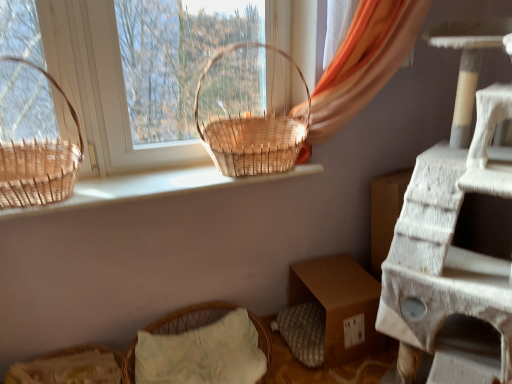
Question: Would you say woven natural basket at center, placed as the second picnic basket when sorted from left to right, is outside natural wood basket at upper center?

Choices:
 (A) no
 (B) yes

Answer: (B)

Question: Considering the relative positions of woven natural basket at center, which appears as the 1th picnic basket when viewed from the right, and natural wood basket at upper center in the image provided, is woven natural basket at center, which appears as the 1th picnic basket when viewed from the right, behind natural wood basket at upper center?

Choices:
 (A) yes
 (B) no

Answer: (A)

Question: Is woven natural basket at center, placed as the second picnic basket when sorted from left to right, at the left side of natural wood basket at upper center?

Choices:
 (A) yes
 (B) no

Answer: (B)

Question: From a real-world perspective, is woven natural basket at center, which appears as the 1th picnic basket when viewed from the right, under natural wood basket at upper center?

Choices:
 (A) yes
 (B) no

Answer: (B)

Question: Does woven natural basket at center, which appears as the 1th picnic basket when viewed from the right, have a greater width compared to natural wood basket at upper center?

Choices:
 (A) no
 (B) yes

Answer: (B)

Question: Considering the relative positions of orange fabric curtain at upper right and natural wood basket at upper center in the image provided, is orange fabric curtain at upper right to the left or to the right of natural wood basket at upper center?

Choices:
 (A) left
 (B) right

Answer: (B)

Question: From the image's perspective, is orange fabric curtain at upper right positioned above or below natural wood basket at upper center?

Choices:
 (A) below
 (B) above

Answer: (B)

Question: Which is correct: orange fabric curtain at upper right is inside natural wood basket at upper center, or outside of it?

Choices:
 (A) inside
 (B) outside

Answer: (B)

Question: From a real-world perspective, is orange fabric curtain at upper right above or below natural wood basket at upper center?

Choices:
 (A) below
 (B) above

Answer: (B)

Question: From the image's perspective, relative to orange fabric curtain at upper right, is brown woven basket at left, which is counted as the first picnic basket, starting from the left, above or below?

Choices:
 (A) above
 (B) below

Answer: (B)

Question: Considering the positions of point (2, 198) and point (386, 52), is point (2, 198) closer or farther from the camera than point (386, 52)?

Choices:
 (A) farther
 (B) closer

Answer: (B)

Question: From a real-world perspective, is brown woven basket at left, which is counted as the first picnic basket, starting from the left, above or below orange fabric curtain at upper right?

Choices:
 (A) above
 (B) below

Answer: (B)

Question: Considering the positions of brown woven basket at left, the second picnic basket viewed from the right, and orange fabric curtain at upper right in the image, is brown woven basket at left, the second picnic basket viewed from the right, taller or shorter than orange fabric curtain at upper right?

Choices:
 (A) tall
 (B) short

Answer: (B)

Question: Is woven straw basket at lower left bigger or smaller than orange fabric curtain at upper right?

Choices:
 (A) big
 (B) small

Answer: (B)

Question: From the image's perspective, is woven straw basket at lower left positioned above or below orange fabric curtain at upper right?

Choices:
 (A) below
 (B) above

Answer: (A)